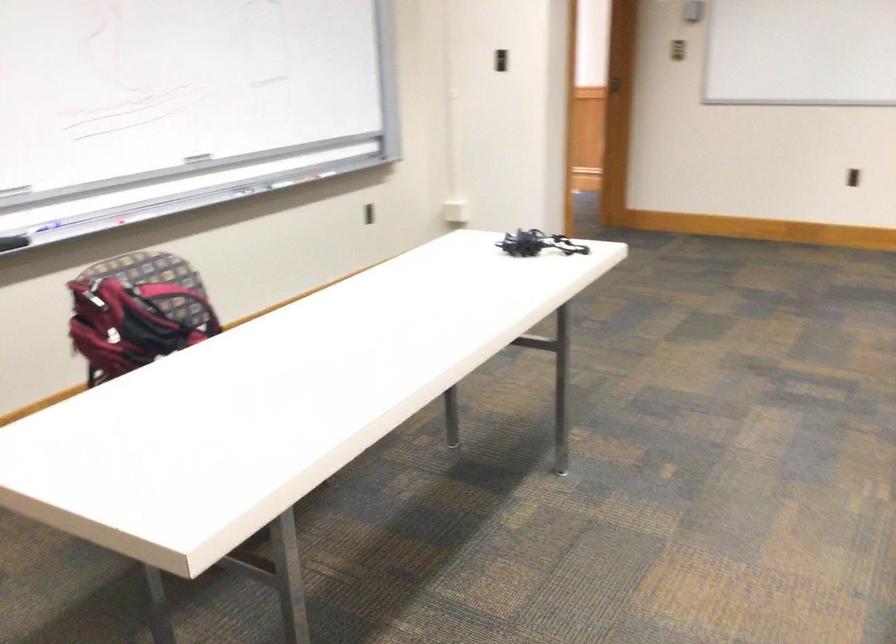
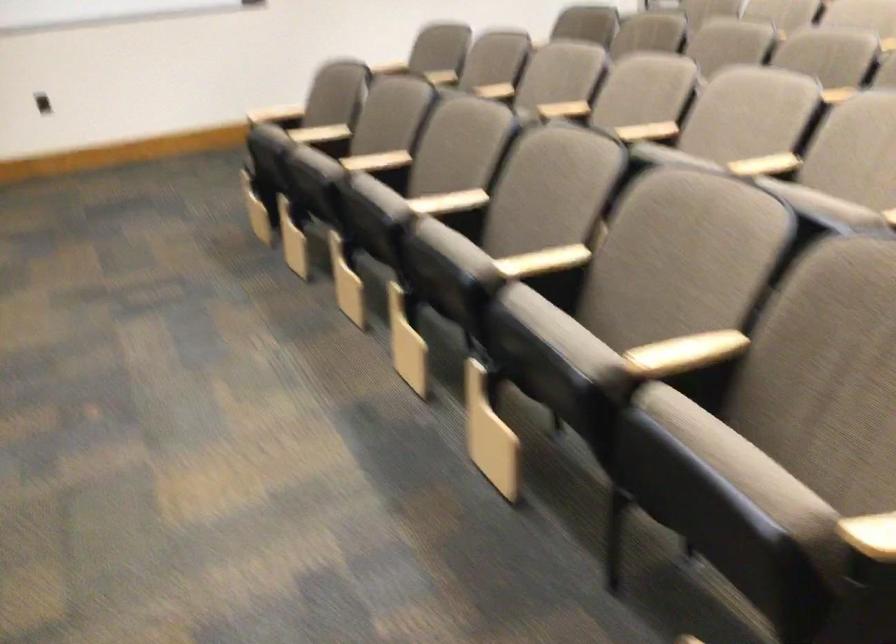
Question: Based on the continuous images, in which direction is the camera rotating? Reply with the corresponding letter.

Choices:
 (A) Left
 (B) Right
 (C) Up
 (D) Down

Answer: (B)